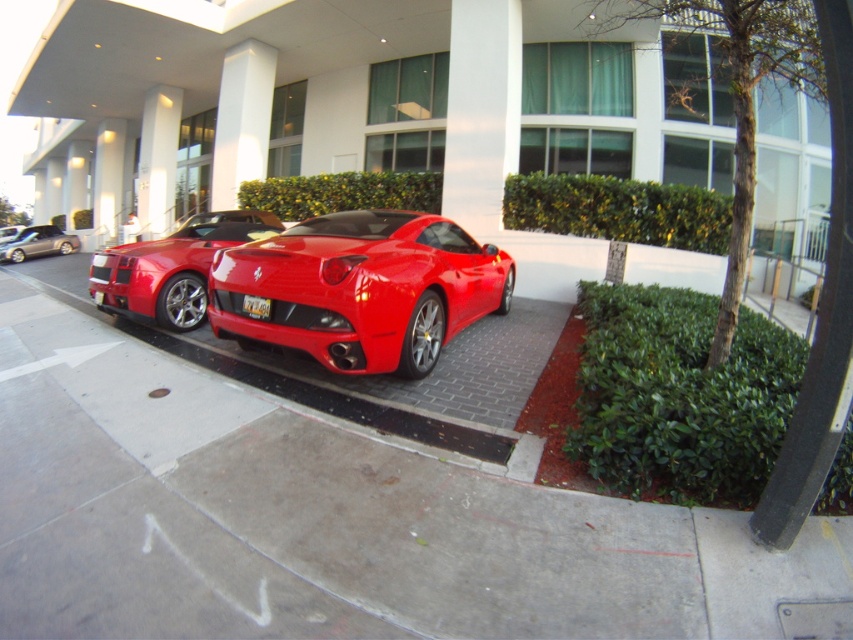
Question: Is glossy red sports car at center positioned in front of shiny red sports car at center?

Choices:
 (A) yes
 (B) no

Answer: (A)

Question: Which object is closer to the camera taking this photo?

Choices:
 (A) silver metallic sedan at left
 (B) glossy red sports car at center

Answer: (B)

Question: In this image, where is glossy concrete curb at lower center located relative to shiny red sports car at center?

Choices:
 (A) left
 (B) right

Answer: (B)

Question: Which point is closer to the camera taking this photo?

Choices:
 (A) (456, 426)
 (B) (485, 3)

Answer: (A)

Question: Which point appears closest to the camera in this image?

Choices:
 (A) (4, 253)
 (B) (511, 464)
 (C) (502, 170)

Answer: (B)

Question: In this image, where is glossy red sports car at center located relative to silver metallic sedan at left?

Choices:
 (A) left
 (B) right

Answer: (B)